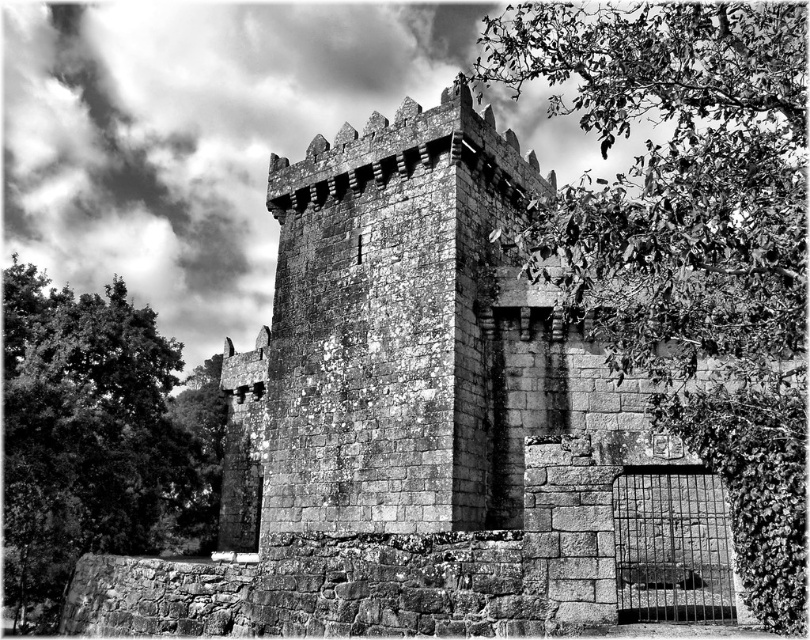
You are an architect examining this historic stone tower. You notice a point marked at coordinates (689, 240). Based on the scene, what might this point be indicating?

The point at coordinates (689, 240) indicates a green leafy tree at upper right.